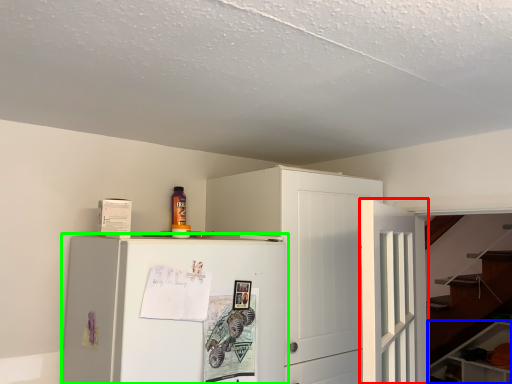
Question: Considering the real-world distances, which object is closest to door (highlighted by a red box)? cabinetry (highlighted by a blue box) or refrigerator (highlighted by a green box).

Choices:
 (A) cabinetry
 (B) refrigerator

Answer: (B)